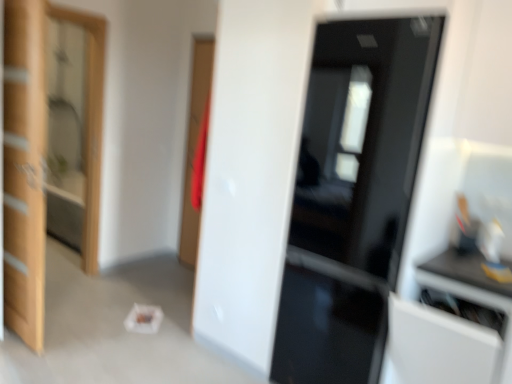
Question: Does glossy black door at center, which is counted as the second door, starting from the left, have a greater width compared to white glossy cabinet at right?

Choices:
 (A) no
 (B) yes

Answer: (A)

Question: Is glossy black door at center, which is the first door from right to left, thinner than white glossy cabinet at right?

Choices:
 (A) yes
 (B) no

Answer: (A)

Question: Considering the relative sizes of glossy black door at center, which is counted as the second door, starting from the left, and white glossy cabinet at right in the image provided, is glossy black door at center, which is counted as the second door, starting from the left, smaller than white glossy cabinet at right?

Choices:
 (A) no
 (B) yes

Answer: (A)

Question: Is glossy black door at center, which is counted as the second door, starting from the left, facing away from white glossy cabinet at right?

Choices:
 (A) yes
 (B) no

Answer: (B)

Question: Would you say white glossy cabinet at right is part of glossy black door at center, which is counted as the second door, starting from the left,'s contents?

Choices:
 (A) yes
 (B) no

Answer: (B)

Question: Looking at their shapes, would you say glossy black door at center, which is the first door from right to left, is wider or thinner than wooden door at left, which is the 2th door from right to left?

Choices:
 (A) thin
 (B) wide

Answer: (B)

Question: Is glossy black door at center, which is counted as the second door, starting from the left, bigger or smaller than wooden door at left, placed as the first door when sorted from left to right?

Choices:
 (A) small
 (B) big

Answer: (B)

Question: In the image, is glossy black door at center, which is the first door from right to left, positioned in front of or behind wooden door at left, placed as the first door when sorted from left to right?

Choices:
 (A) front
 (B) behind

Answer: (A)

Question: In terms of height, does glossy black door at center, which is the first door from right to left, look taller or shorter compared to wooden door at left, which is the 2th door from right to left?

Choices:
 (A) tall
 (B) short

Answer: (A)

Question: From the image's perspective, is white glossy cabinet at right positioned above or below clear glass screen door at left?

Choices:
 (A) above
 (B) below

Answer: (B)

Question: From a real-world perspective, is white glossy cabinet at right positioned above or below clear glass screen door at left?

Choices:
 (A) above
 (B) below

Answer: (B)

Question: Choose the correct answer: Is white glossy cabinet at right inside clear glass screen door at left or outside it?

Choices:
 (A) inside
 (B) outside

Answer: (B)

Question: Considering the relative positions of white glossy cabinet at right and clear glass screen door at left in the image provided, is white glossy cabinet at right to the left or to the right of clear glass screen door at left?

Choices:
 (A) right
 (B) left

Answer: (A)

Question: Considering the positions of point (51, 3) and point (23, 79), is point (51, 3) closer or farther from the camera than point (23, 79)?

Choices:
 (A) closer
 (B) farther

Answer: (B)

Question: Is clear glass screen door at left bigger or smaller than wooden door at left, placed as the first door when sorted from left to right?

Choices:
 (A) big
 (B) small

Answer: (B)